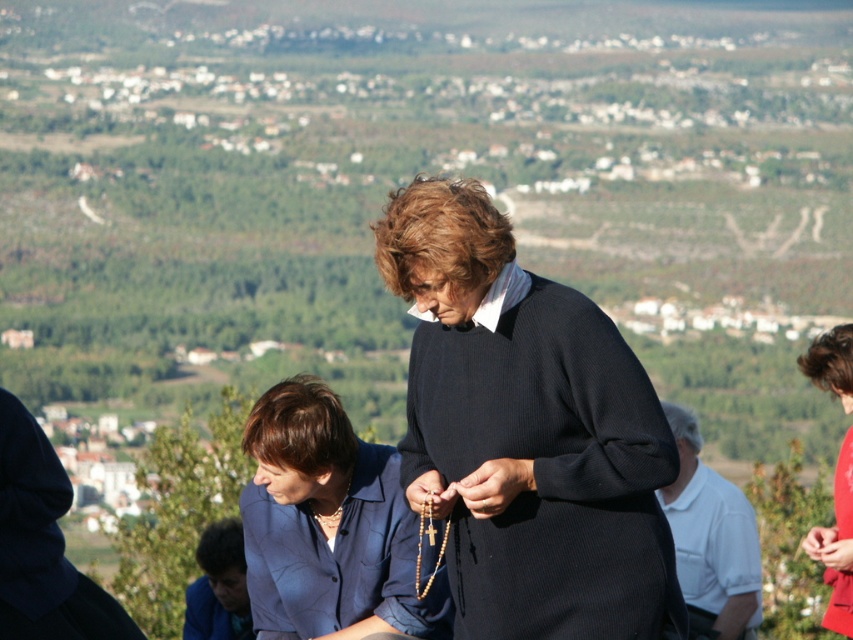
Can you confirm if black ribbed sweater at center is positioned below dark blue woolen robe at lower left?

Incorrect, black ribbed sweater at center is not positioned below dark blue woolen robe at lower left.

Who is more forward, (560,636) or (15,496)?

Point (560,636) is more forward.

Find the location of `black ribbed sweater at center`. black ribbed sweater at center is located at coordinates (546, 467).

Which is behind, point (465, 624) or point (840, 499)?

Point (840, 499)

Is black ribbed sweater at center wider than red matte dress at lower right?

In fact, black ribbed sweater at center might be narrower than red matte dress at lower right.

Is point (665, 529) positioned behind point (842, 461)?

No, it is in front of (842, 461).

Where is `black ribbed sweater at center`? This screenshot has height=640, width=853. black ribbed sweater at center is located at coordinates (546, 467).

Which is above, dark blue woolen robe at lower left or matte red coat at center?

matte red coat at center is higher up.

The height and width of the screenshot is (640, 853). Find the location of `dark blue woolen robe at lower left`. dark blue woolen robe at lower left is located at coordinates (42, 545).